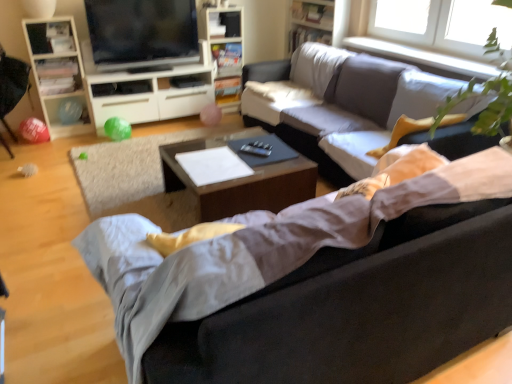
Question: Does transparent glass window at upper right have a larger size compared to white matte sheet at center?

Choices:
 (A) yes
 (B) no

Answer: (A)

Question: Is transparent glass window at upper right smaller than white matte sheet at center?

Choices:
 (A) yes
 (B) no

Answer: (B)

Question: Could you tell me if transparent glass window at upper right is facing white matte sheet at center?

Choices:
 (A) yes
 (B) no

Answer: (B)

Question: Is transparent glass window at upper right next to white matte sheet at center?

Choices:
 (A) yes
 (B) no

Answer: (B)

Question: Considering the relative positions of transparent glass window at upper right and white matte sheet at center in the image provided, is transparent glass window at upper right in front of white matte sheet at center?

Choices:
 (A) no
 (B) yes

Answer: (A)

Question: Is transparent glass window at upper right thinner than white matte sheet at center?

Choices:
 (A) yes
 (B) no

Answer: (A)

Question: From a real-world perspective, is matte white cabinet at center left on dark gray fabric couch at center, which is counted as the second studio couch, starting from the back?

Choices:
 (A) yes
 (B) no

Answer: (B)

Question: From the image's perspective, is matte white cabinet at center left above dark gray fabric couch at center, which is counted as the second studio couch, starting from the back?

Choices:
 (A) yes
 (B) no

Answer: (A)

Question: Is matte white cabinet at center left facing towards dark gray fabric couch at center, which is counted as the second studio couch, starting from the back?

Choices:
 (A) yes
 (B) no

Answer: (A)

Question: Does matte white cabinet at center left have a greater width compared to dark gray fabric couch at center, which is counted as the second studio couch, starting from the back?

Choices:
 (A) yes
 (B) no

Answer: (B)

Question: From a real-world perspective, is matte white cabinet at center left under dark gray fabric couch at center, which is counted as the second studio couch, starting from the back?

Choices:
 (A) yes
 (B) no

Answer: (A)

Question: Is matte white cabinet at center left further to camera compared to dark gray fabric couch at center, the 1th studio couch from the front?

Choices:
 (A) no
 (B) yes

Answer: (B)

Question: Could you tell me if wooden bookshelf at upper center, acting as the 1th bookshelf starting from the left, is turned towards woodenwoodencoffee table at center?

Choices:
 (A) no
 (B) yes

Answer: (A)